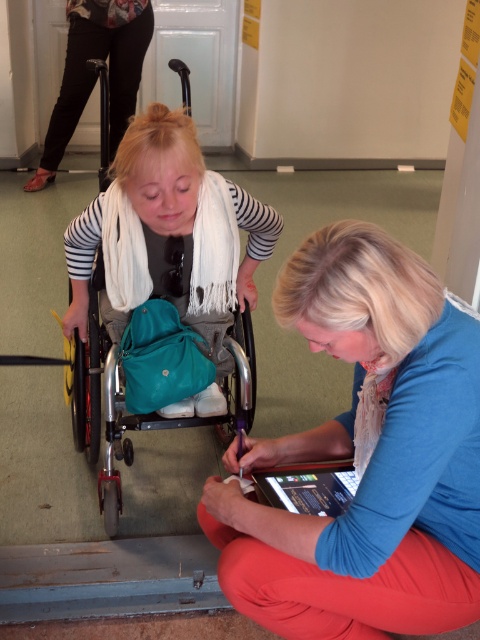
Looking at this image, you are designing a layout for a new community center and need to place a teal fabric wheelchair at center and a blue fabric at lower right. Given their sizes, which object requires more horizontal space in the design?

The teal fabric wheelchair at center requires more horizontal space because it has a greater width than the blue fabric at lower right.

You are a delivery robot with a height of 1.2 meters. You need to deliver a package to the point marked at coordinates (434, 435). The camera is positioned at a certain location. Can you safely reach the delivery point without exceeding your height limit?

The point at coordinates (434, 435) is 1.01 meters away from the camera. Since the robot is 1.2 meters tall, it can safely reach the delivery point as the distance does not exceed its height limit.